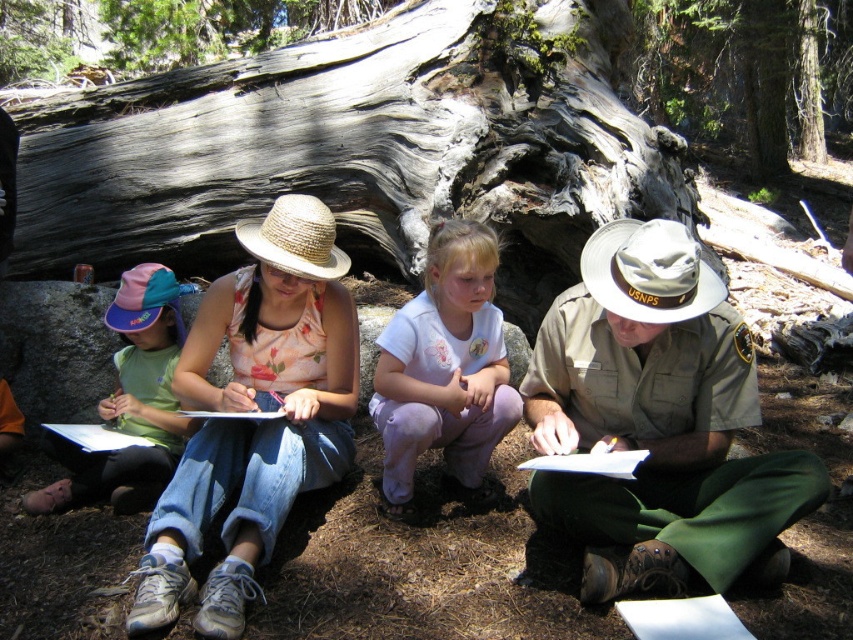
Question: Does pale pink cotton shirt at center have a larger size compared to gray rough bark tree trunk at upper center?

Choices:
 (A) yes
 (B) no

Answer: (A)

Question: Estimate the real-world distances between objects in this image. Which object is closer to the khaki uniform at center?

Choices:
 (A) green fabric hat at left
 (B) matte straw hat at center
 (C) pale pink cotton shirt at center

Answer: (C)

Question: Does matte straw hat at center come behind gray rough bark tree trunk at upper center?

Choices:
 (A) no
 (B) yes

Answer: (A)

Question: Does khaki uniform at center have a larger size compared to pale pink cotton shirt at center?

Choices:
 (A) no
 (B) yes

Answer: (B)

Question: Which point is closer to the camera?

Choices:
 (A) (482, 355)
 (B) (105, 467)

Answer: (A)

Question: Which object is positioned closest to the pale pink cotton shirt at center?

Choices:
 (A) green fabric hat at left
 (B) khaki uniform at center
 (C) matte straw hat at center

Answer: (C)